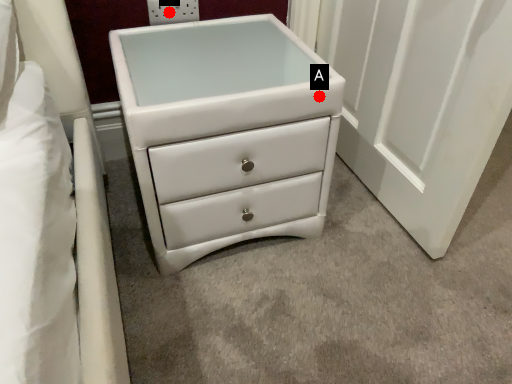
Question: Two points are circled on the image, labeled by A and B beside each circle. Which point is farther from the camera taking this photo?

Choices:
 (A) A is further
 (B) B is further

Answer: (B)